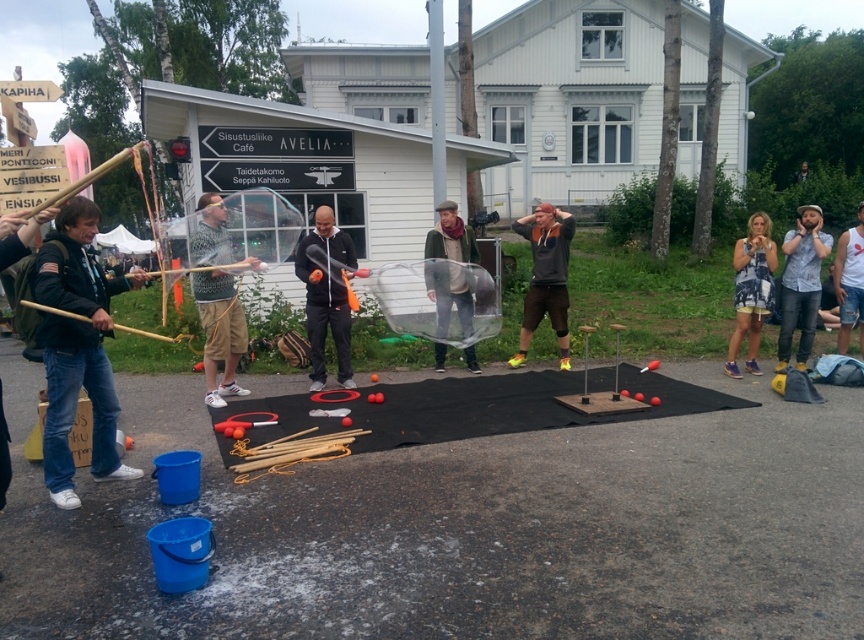
You are standing at the point labeled as point [791,269] and want to walk towards the black mat where the performers are creating the bubble. Is the point labeled as point [221,308] located in front of you or behind you as you walk towards the black mat?

The point labeled as point [221,308] is in front of point [791,269], so as you walk towards the black mat, the point labeled as point [221,308] will be in front of you.

Please use the coordinate system where the origin is at the bottom left corner of the image. The black mat is located at the center of the image. The denim jacket at left is located at point (77, 348). Is the denim jacket at left on the black mat?

The denim jacket at left is located at point (77, 348), which is not on the black mat since the black mat is at the center of the image.

You are a photographer trying to capture a photo of the performers. You notice two shirts in the scene, the patterned fabric shirt at center and the denim shirt at right. Which shirt should you focus on if you want to highlight a larger clothing item in your photo?

The patterned fabric shirt at center has a larger size compared to the denim shirt at right, so focusing on the patterned fabric shirt at center will highlight the larger clothing item.